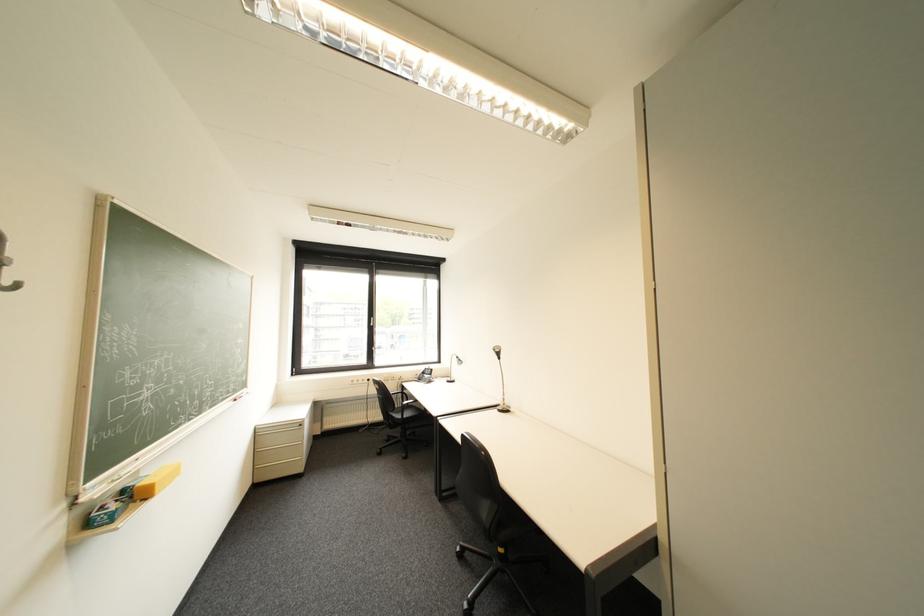
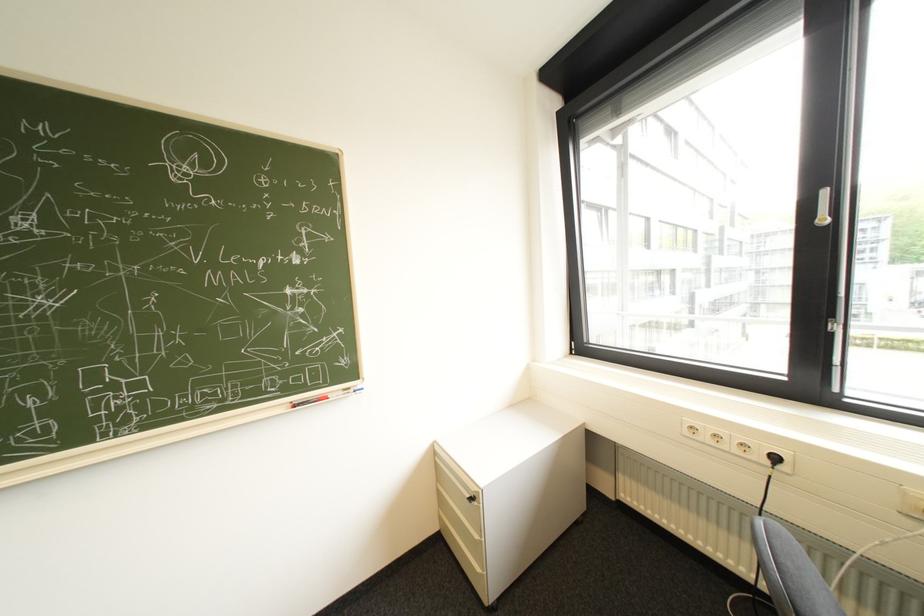
Find the pixel in the second image that matches the point at 366,383 in the first image.

(715, 438)